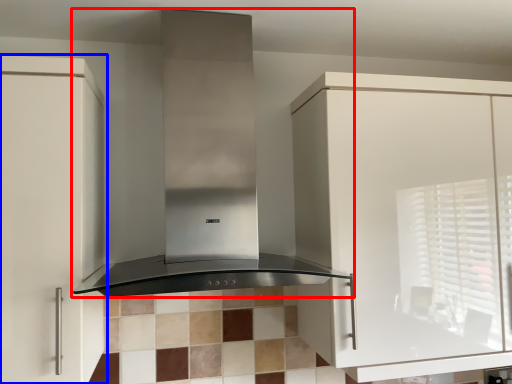
Question: Which object appears closest to the camera in this image, home appliance (highlighted by a red box) or cabinetry (highlighted by a blue box)?

Choices:
 (A) home appliance
 (B) cabinetry

Answer: (A)